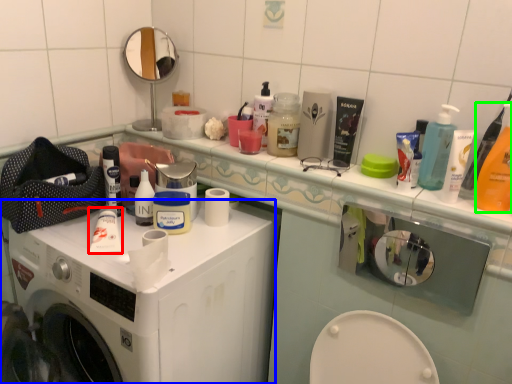
Question: Which object is positioned farthest from toothpaste (highlighted by a red box)? Select from washing machine (highlighted by a blue box) and cleaning product (highlighted by a green box).

Choices:
 (A) washing machine
 (B) cleaning product

Answer: (B)